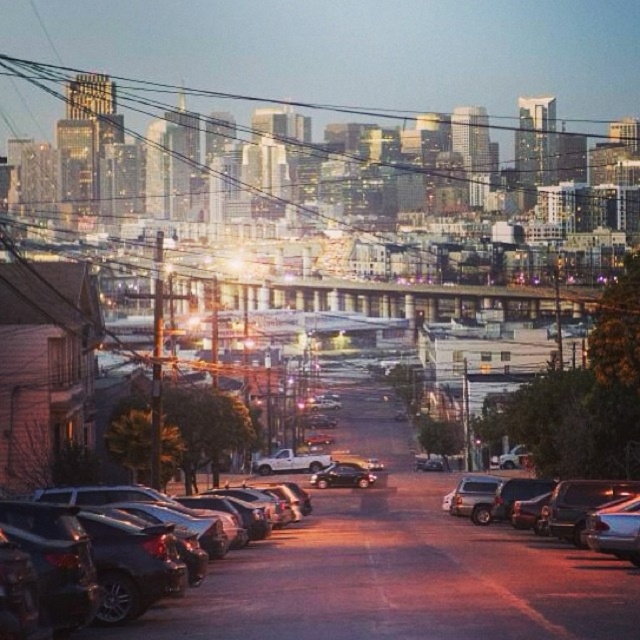
You are a delivery driver who needs to park your vehicle in this area. You see the shiny silver sedan at lower right and the shiny black sedan at lower left. Which parking spot is currently occupied by the vehicle that is parked underneath the other car?

The shiny silver sedan at lower right is positioned under the shiny black sedan at lower left, so the parking spot occupied by the shiny silver sedan at lower right is under the shiny black sedan at lower left.

You are a delivery drone operator. Your drone is currently above the metallic wire at upper center and needs to deliver a package to the satin black sedan at center. Can the drone safely descend vertically from its current position to land on the sedan?

The metallic wire at upper center might be wider than the satin black sedan at center, so there is uncertainty about whether the drone can safely descend vertically. The operator should adjust the drone to move slightly to the side to ensure clearance before landing.

You are a delivery drone operator. Your drone is currently at the coordinates given for the metallic wire at upper center. You need to fly it to the nearest building in the image. Which direction should you fly the drone to reach the nearest building?

The metallic wire at upper center is located at point (234,99). The nearest building would be the closest structure in the scene. Since the image shows a transition from residential to industrial areas midway, and the wire is at upper center, the nearest building is likely in the mid to lower part of the image. Therefore, the drone should fly downward from the metallic wire at upper center to reach the nearest building.